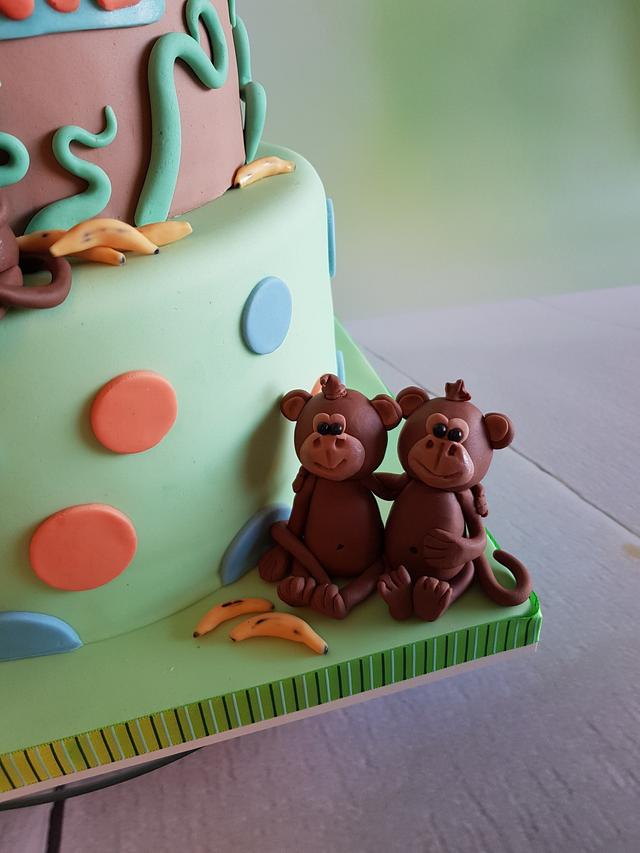
Identify the location of wooden table. (445, 740).